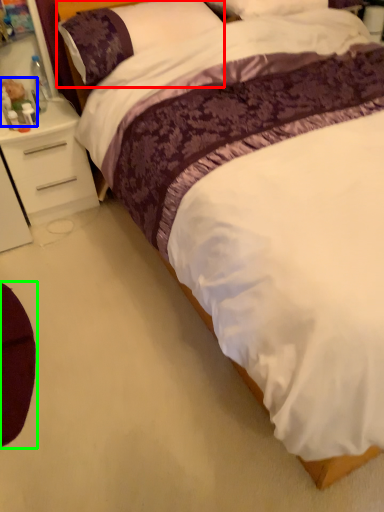
Question: Based on their relative distances, which object is nearer to pillow (highlighted by a red box)? Choose from toy (highlighted by a blue box) and swivel chair (highlighted by a green box).

Choices:
 (A) toy
 (B) swivel chair

Answer: (A)